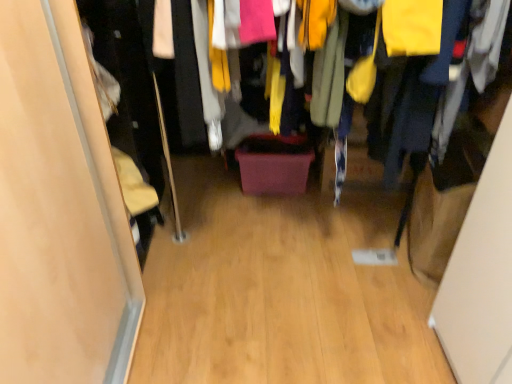
What are the coordinates of `wooden floor at center` in the screenshot? It's located at tap(128, 73).

Considering the points (70, 192) and (86, 15), which point is in front, point (70, 192) or point (86, 15)?

The point (70, 192) is closer.

From their relative heights in the image, would you say matte wood door at left is taller or shorter than wooden floor at center?

In the image, matte wood door at left appears to be taller than wooden floor at center.

From a real-world perspective, between matte wood door at left and wooden floor at center, who is vertically lower?

matte wood door at left, from a real-world perspective.

In order to click on door that is behind the wooden floor at center in this screenshot , I will do `click(59, 210)`.

Choose the correct answer: Is wooden floor at center inside wooden floor at center or outside it?

wooden floor at center lies outside wooden floor at center.

Is wooden floor at center facing towards wooden floor at center?

No, wooden floor at center does not turn towards wooden floor at center.

How many degrees apart are the facing directions of wooden floor at center and wooden floor at center?

They differ by 0.548 degrees in their facing directions.

Does wooden floor at center have a lesser width compared to wooden floor at center?

Yes.

Is wooden floor at center facing away from matte wood door at left?

No, matte wood door at left is not at the back of wooden floor at center.

In terms of height, does wooden floor at center look taller or shorter compared to matte wood door at left?

Clearly, wooden floor at center is shorter compared to matte wood door at left.

Would you say matte wood door at left is part of wooden floor at center's contents?

No, wooden floor at center does not contain matte wood door at left.

Which is behind, wooden floor at center or matte wood door at left?

Positioned behind is wooden floor at center.

In terms of width, does wooden floor at center look wider or thinner when compared to matte wood door at left?

Considering their sizes, wooden floor at center looks broader than matte wood door at left.

In the scene shown: Is wooden floor at center oriented away from matte wood door at left?

That's not correct — wooden floor at center is not looking away from matte wood door at left.

Is wooden floor at center further to the viewer compared to matte wood door at left?

No, the depth of wooden floor at center is less than that of matte wood door at left.

Does matte wood door at left have a larger size compared to wooden floor at center?

Yes, matte wood door at left is bigger than wooden floor at center.

From a real-world perspective, is matte wood door at left below wooden floor at center?

Actually, matte wood door at left is physically above wooden floor at center in the real world.

This screenshot has height=384, width=512. What are the coordinates of `plain to the right of matte wood door at left` in the screenshot? It's located at (280, 292).

Which object is thinner, matte wood door at left or wooden floor at center?

Thinner between the two is matte wood door at left.

Is wooden floor at center looking in the opposite direction of wooden floor at center?

No.

How different are the orientations of wooden floor at center and wooden floor at center in degrees?

There is a 0.548-degree angle between the facing directions of wooden floor at center and wooden floor at center.

From a real-world perspective, which object stands above the other?

wooden floor at center, from a real-world perspective.

I want to click on door below the wooden floor at center (from a real-world perspective), so click(x=59, y=210).

Identify the location of plain behind the wooden floor at center. The height and width of the screenshot is (384, 512). (280, 292).

Which object lies nearer to the anchor point wooden floor at center, wooden floor at center or matte wood door at left?

Based on the image, matte wood door at left appears to be nearer to wooden floor at center.

When comparing their distances from matte wood door at left, does wooden floor at center or wooden floor at center seem closer?

Based on the image, wooden floor at center appears to be nearer to matte wood door at left.

Consider the image. Which object lies nearer to the anchor point wooden floor at center, wooden floor at center or matte wood door at left?

matte wood door at left lies closer to wooden floor at center than the other object.

Considering their positions, is wooden floor at center positioned closer to matte wood door at left than wooden floor at center?

Among the two, wooden floor at center is located nearer to matte wood door at left.

From the image, which object appears to be farther from wooden floor at center, matte wood door at left or wooden floor at center?

wooden floor at center lies further to wooden floor at center than the other object.

Consider the image. From the image, which object appears to be nearer to wooden floor at center, matte wood door at left or wooden floor at center?

matte wood door at left is positioned closer to the anchor wooden floor at center.

I want to click on plain between matte wood door at left and wooden floor at center in the horizontal direction, so click(x=280, y=292).